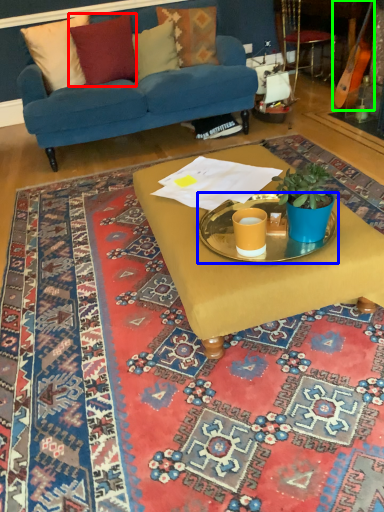
Question: Which object is the closest to the pillow (highlighted by a red box)? Choose among these: round table (highlighted by a blue box) or instrument (highlighted by a green box).

Choices:
 (A) round table
 (B) instrument

Answer: (B)